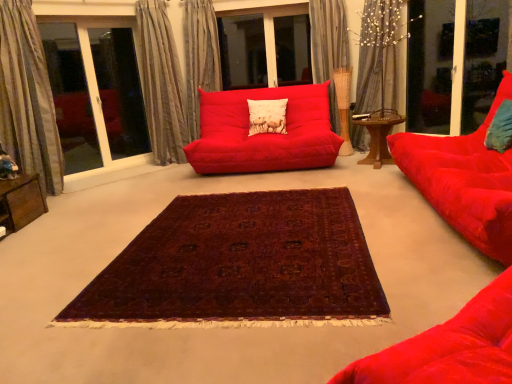
Question: Is transparent glass bay window at upper left oriented away from matte white cushion at center, which is the first pillow in back-to-front order?

Choices:
 (A) yes
 (B) no

Answer: (B)

Question: Can you confirm if transparent glass bay window at upper left is taller than matte white cushion at center, positioned as the 1th pillow in left-to-right order?

Choices:
 (A) yes
 (B) no

Answer: (A)

Question: Is transparent glass bay window at upper left outside matte white cushion at center, positioned as the 1th pillow in left-to-right order?

Choices:
 (A) no
 (B) yes

Answer: (B)

Question: From the image's perspective, is transparent glass bay window at upper left above matte white cushion at center, acting as the second pillow starting from the front?

Choices:
 (A) no
 (B) yes

Answer: (B)

Question: Is transparent glass bay window at upper left at the right side of matte white cushion at center, positioned as the 1th pillow in left-to-right order?

Choices:
 (A) yes
 (B) no

Answer: (B)

Question: From their relative heights in the image, would you say transparent glass screen door at upper right is taller or shorter than wooden table at center, which is counted as the first table, starting from the back?

Choices:
 (A) tall
 (B) short

Answer: (A)

Question: Does point (451, 61) appear closer or farther from the camera than point (398, 122)?

Choices:
 (A) closer
 (B) farther

Answer: (B)

Question: Do you think transparent glass screen door at upper right is within wooden table at center, positioned as the 2th table in front-to-back order, or outside of it?

Choices:
 (A) inside
 (B) outside

Answer: (B)

Question: From the image's perspective, is transparent glass screen door at upper right above or below wooden table at center, which is the 1th table from top to bottom?

Choices:
 (A) above
 (B) below

Answer: (A)

Question: From the image's perspective, relative to deep burgundy woven rug at center, is transparent glass bay window at upper left above or below?

Choices:
 (A) above
 (B) below

Answer: (A)

Question: Would you say transparent glass bay window at upper left is to the left or to the right of deep burgundy woven rug at center in the picture?

Choices:
 (A) left
 (B) right

Answer: (A)

Question: Is transparent glass bay window at upper left taller or shorter than deep burgundy woven rug at center?

Choices:
 (A) tall
 (B) short

Answer: (A)

Question: From a real-world perspective, relative to deep burgundy woven rug at center, is transparent glass bay window at upper left vertically above or below?

Choices:
 (A) above
 (B) below

Answer: (A)

Question: From the image's perspective, is wooden table at center, which is counted as the first table, starting from the back, positioned above or below deep burgundy woven rug at center?

Choices:
 (A) below
 (B) above

Answer: (B)

Question: Is wooden table at center, positioned as the 2th table in front-to-back order, taller or shorter than deep burgundy woven rug at center?

Choices:
 (A) short
 (B) tall

Answer: (B)